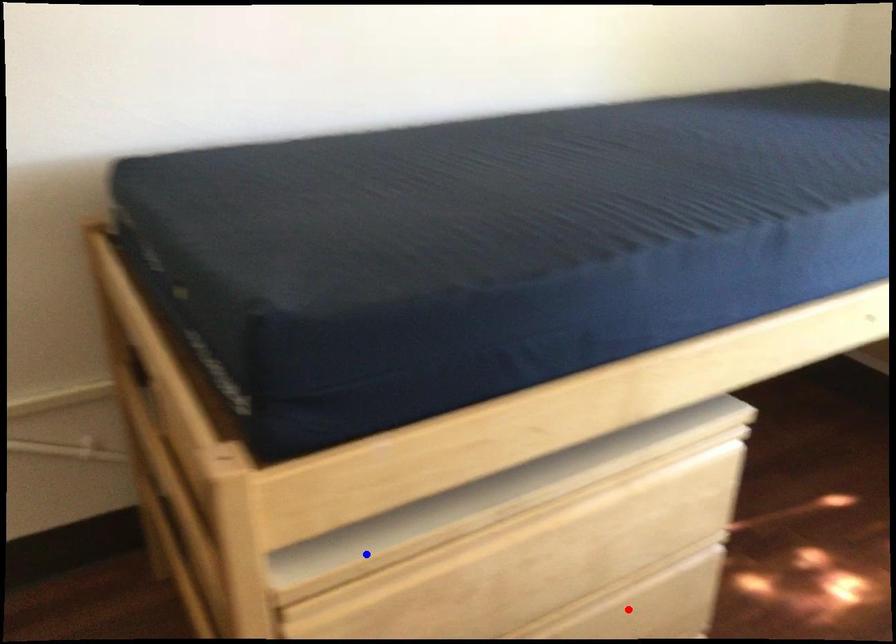
Question: Which of the two points in the image is closer to the camera?

Choices:
 (A) Blue point is closer.
 (B) Red point is closer.

Answer: (A)